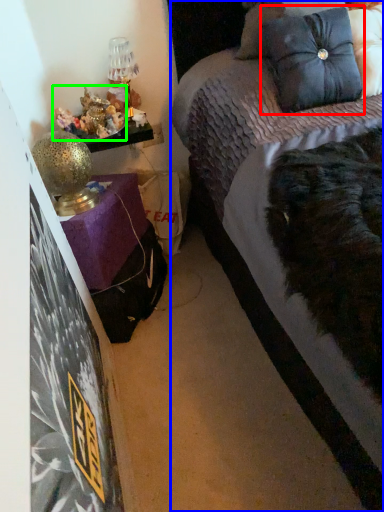
Question: Which object is the closest to the pillow (highlighted by a red box)? Choose among these: bed (highlighted by a blue box) or stuff (highlighted by a green box).

Choices:
 (A) bed
 (B) stuff

Answer: (B)